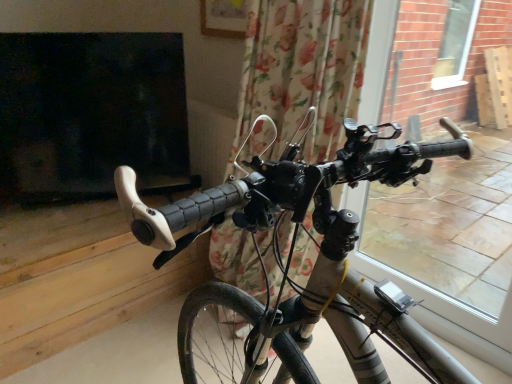
Question: From the image's perspective, is matte black handlebars at center located beneath transparent glass window at right?

Choices:
 (A) yes
 (B) no

Answer: (A)

Question: Considering the relative sizes of matte black handlebars at center and transparent glass window at right in the image provided, is matte black handlebars at center taller than transparent glass window at right?

Choices:
 (A) yes
 (B) no

Answer: (B)

Question: From the image's perspective, does matte black handlebars at center appear higher than transparent glass window at right?

Choices:
 (A) no
 (B) yes

Answer: (A)

Question: Is matte black handlebars at center to the right of transparent glass window at right from the viewer's perspective?

Choices:
 (A) yes
 (B) no

Answer: (B)

Question: Does matte black handlebars at center come behind transparent glass window at right?

Choices:
 (A) no
 (B) yes

Answer: (A)

Question: From their relative heights in the image, would you say floral fabric curtain at center is taller or shorter than matte black handlebars at center?

Choices:
 (A) short
 (B) tall

Answer: (B)

Question: Is floral fabric curtain at center in front of or behind matte black handlebars at center in the image?

Choices:
 (A) behind
 (B) front

Answer: (A)

Question: Is point (306, 140) closer or farther from the camera than point (385, 329)?

Choices:
 (A) closer
 (B) farther

Answer: (B)

Question: From a real-world perspective, is floral fabric curtain at center positioned above or below matte black handlebars at center?

Choices:
 (A) above
 (B) below

Answer: (A)

Question: Is matte black handlebars at center wider or thinner than floral fabric curtain at center?

Choices:
 (A) wide
 (B) thin

Answer: (A)

Question: Choose the correct answer: Is matte black handlebars at center inside floral fabric curtain at center or outside it?

Choices:
 (A) inside
 (B) outside

Answer: (B)

Question: Is point (293, 167) positioned closer to the camera than point (280, 56)?

Choices:
 (A) farther
 (B) closer

Answer: (B)

Question: Based on their sizes in the image, would you say matte black handlebars at center is bigger or smaller than floral fabric curtain at center?

Choices:
 (A) big
 (B) small

Answer: (A)

Question: In terms of size, does transparent glass window at right appear bigger or smaller than floral fabric curtain at center?

Choices:
 (A) big
 (B) small

Answer: (B)

Question: Would you say transparent glass window at right is to the left or to the right of floral fabric curtain at center in the picture?

Choices:
 (A) right
 (B) left

Answer: (A)